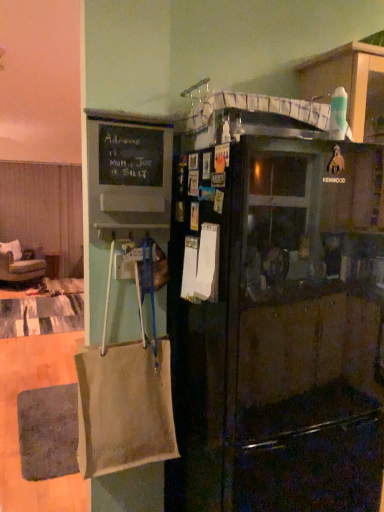
The height and width of the screenshot is (512, 384). What are the coordinates of `green fabric chair at left` in the screenshot? It's located at (20, 263).

Measure the distance between point (123, 163) and camera.

Point (123, 163) and camera are 1.33 meters apart.

The height and width of the screenshot is (512, 384). I want to click on green fabric chair at left, so click(x=20, y=263).

Which is more to the right, green fabric chair at left or black matte refrigerator at center?

black matte refrigerator at center.

Measure the distance between green fabric chair at left and black matte refrigerator at center.

The distance of green fabric chair at left from black matte refrigerator at center is 5.54 meters.

Which of these two, green fabric chair at left or black matte refrigerator at center, is bigger?

green fabric chair at left.

From a real-world perspective, is green fabric chair at left on black matte refrigerator at center?

No.

Is beige canvas bag at left facing towards black chalkboard at upper left?

No, beige canvas bag at left does not turn towards black chalkboard at upper left.

Can you confirm if beige canvas bag at left is bigger than black chalkboard at upper left?

Yes.

Is beige canvas bag at left surrounding black chalkboard at upper left?

No, black chalkboard at upper left is not a part of beige canvas bag at left.

Considering their positions, is beige canvas bag at left located in front of or behind black chalkboard at upper left?

beige canvas bag at left is in front of black chalkboard at upper left.

Can you tell me how much green fabric chair at left and beige canvas bag at left differ in facing direction?

They differ by 0.000118 degrees in their facing directions.

Is point (13, 282) behind point (111, 384)?

Yes, point (13, 282) is farther from viewer.

Is green fabric chair at left positioned in front of beige canvas bag at left?

No, green fabric chair at left is further to the viewer.

Is green fabric chair at left bigger or smaller than beige canvas bag at left?

Considering their sizes, green fabric chair at left takes up more space than beige canvas bag at left.

Is black chalkboard at upper left shorter than beige canvas bag at left?

Indeed, black chalkboard at upper left has a lesser height compared to beige canvas bag at left.

Based on the photo, are black chalkboard at upper left and beige canvas bag at left far apart?

No, black chalkboard at upper left is in close proximity to beige canvas bag at left.

Is black chalkboard at upper left oriented towards beige canvas bag at left?

No, black chalkboard at upper left is not facing towards beige canvas bag at left.

Does black chalkboard at upper left have a lesser width compared to beige canvas bag at left?

Indeed, black chalkboard at upper left has a lesser width compared to beige canvas bag at left.

How far apart are beige fabric curtain at left and black chalkboard at upper left?

beige fabric curtain at left and black chalkboard at upper left are 5.56 meters apart from each other.

Is beige fabric curtain at left to the left of black chalkboard at upper left from the viewer's perspective?

Indeed, beige fabric curtain at left is positioned on the left side of black chalkboard at upper left.

Which of these two, beige fabric curtain at left or black chalkboard at upper left, stands taller?

beige fabric curtain at left.

From a real-world perspective, is beige fabric curtain at left over black chalkboard at upper left?

No.

Are beige fabric curtain at left and green fabric chair at left making contact?

No, beige fabric curtain at left is not beside green fabric chair at left.

Consider the image. From the image's perspective, is beige fabric curtain at left over green fabric chair at left?

Yes, from the image's perspective, beige fabric curtain at left is above green fabric chair at left.

Could you tell me if beige fabric curtain at left is facing green fabric chair at left?

No, beige fabric curtain at left is not aimed at green fabric chair at left.

Which object is thinner, beige fabric curtain at left or green fabric chair at left?

beige fabric curtain at left.

Based on the photo, are beige fabric curtain at left and black matte refrigerator at center far apart?

Indeed, beige fabric curtain at left is not near black matte refrigerator at center.

Looking at this image, from a real-world perspective, is beige fabric curtain at left above or below black matte refrigerator at center?

In terms of real-world spatial position, beige fabric curtain at left is above black matte refrigerator at center.

Which object is positioned more to the right, beige fabric curtain at left or black matte refrigerator at center?

black matte refrigerator at center.

Identify the location of chair behind the black matte refrigerator at center. This screenshot has height=512, width=384. (20, 263).

At what (x,y) coordinates should I click in order to perform the action: click on bulletin board lying above the beige canvas bag at left (from the image's perspective). Please return your answer as a coordinate pair (x, y). The width and height of the screenshot is (384, 512). Looking at the image, I should click on (131, 167).

Based on their spatial positions, is green fabric chair at left or beige fabric curtain at left closer to black chalkboard at upper left?

Among the two, green fabric chair at left is located nearer to black chalkboard at upper left.

Looking at the image, which one is located further to beige fabric curtain at left, beige canvas bag at left or green fabric chair at left?

Based on the image, beige canvas bag at left appears to be further to beige fabric curtain at left.

Based on their spatial positions, is black matte refrigerator at center or beige canvas bag at left further from beige fabric curtain at left?

black matte refrigerator at center lies further to beige fabric curtain at left than the other object.

Considering their positions, is black chalkboard at upper left positioned further to beige canvas bag at left than black matte refrigerator at center?

black chalkboard at upper left is further to beige canvas bag at left.

Looking at the image, which one is located further to green fabric chair at left, beige fabric curtain at left or beige canvas bag at left?

beige canvas bag at left is positioned further to the anchor green fabric chair at left.

Estimate the real-world distances between objects in this image. Which object is closer to black matte refrigerator at center, black chalkboard at upper left or beige fabric curtain at left?

black chalkboard at upper left is positioned closer to the anchor black matte refrigerator at center.

Which object lies nearer to the anchor point beige canvas bag at left, green fabric chair at left or black chalkboard at upper left?

black chalkboard at upper left lies closer to beige canvas bag at left than the other object.

Estimate the real-world distances between objects in this image. Which object is closer to beige fabric curtain at left, beige canvas bag at left or black matte refrigerator at center?

Among the two, beige canvas bag at left is located nearer to beige fabric curtain at left.

Where is `grocery bag that lies between black chalkboard at upper left and black matte refrigerator at center from top to bottom`? grocery bag that lies between black chalkboard at upper left and black matte refrigerator at center from top to bottom is located at coordinates (124, 398).

The image size is (384, 512). I want to click on bulletin board between beige canvas bag at left and green fabric chair at left from front to back, so click(131, 167).

Identify the location of bulletin board positioned between black matte refrigerator at center and green fabric chair at left from near to far. (131, 167).

The height and width of the screenshot is (512, 384). Find the location of `chair between black matte refrigerator at center and beige fabric curtain at left in the front-back direction`. chair between black matte refrigerator at center and beige fabric curtain at left in the front-back direction is located at coordinates (20, 263).